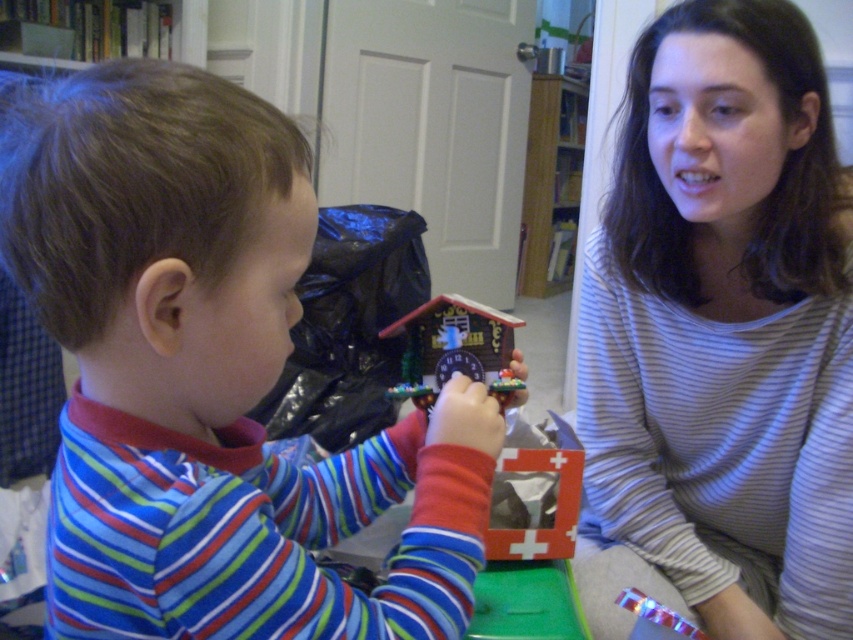
You are a photographer trying to capture the striped cotton shirt at center and the wooden cuckoo clock at center in the same frame. Based on their positions, which object should you adjust your camera focus to first to ensure both are in the frame?

The striped cotton shirt at center is positioned on the right side of wooden cuckoo clock at center. To capture both in the same frame, focus on the wooden cuckoo clock at center first, then adjust the camera to include the striped cotton shirt at center on the right side.

You are a tailor who needs to determine which item requires more fabric between the striped fabric shirt at left and the wooden cuckoo clock at center. Based on their sizes, which one would need more fabric?

The striped fabric shirt at left requires more fabric than the wooden cuckoo clock at center because it has a larger size.

You are a photographer trying to capture the striped fabric shirt at left in the image. Where should you focus your camera to ensure it is centered in the frame?

You should focus your camera at point (210, 380) to center the striped fabric shirt at left in the frame.